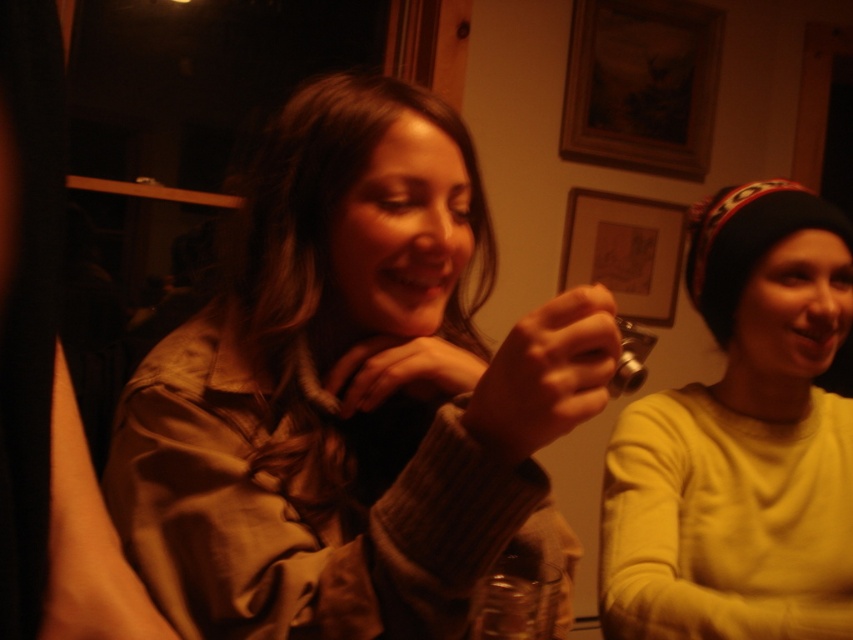
Which of these two, matte yellow sweater at right or wooden picture frame at upper center, stands taller?

With more height is matte yellow sweater at right.

Between point (599, 550) and point (612, 292), which one is positioned behind?

The point (612, 292) is behind.

Find the location of `matte yellow sweater at right`. matte yellow sweater at right is located at coordinates (741, 442).

Looking at this image, does matte yellow sweater at right appear over wooden frame at upper center?

Actually, matte yellow sweater at right is below wooden frame at upper center.

Between matte yellow sweater at right and wooden frame at upper center, which one has more height?

Standing taller between the two is wooden frame at upper center.

You are a GUI agent. You are given a task and a screenshot of the screen. Output one action in this format:
    pyautogui.click(x=<x>, y=<y>)
    Task: Click on the matte yellow sweater at right
    The image size is (853, 640).
    Given the screenshot: What is the action you would take?
    pyautogui.click(x=741, y=442)

Between matte brown jacket at center and wooden frame at upper center, which one appears on the left side from the viewer's perspective?

From the viewer's perspective, matte brown jacket at center appears more on the left side.

Who is shorter, matte brown jacket at center or wooden frame at upper center?

With less height is matte brown jacket at center.

Where is `matte brown jacket at center`? matte brown jacket at center is located at coordinates (352, 394).